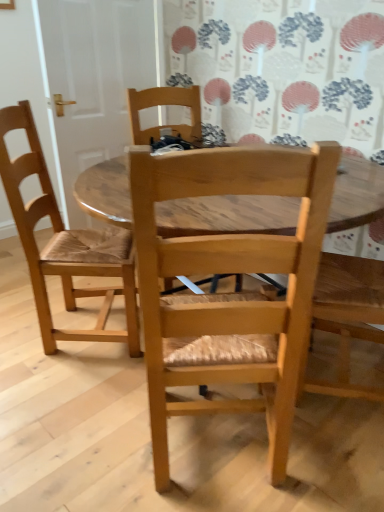
Question: Considering the positions of light wood/marble chair at center, the 2th chair viewed from the left, and light brown wood chair at left, which is counted as the 2th chair, starting from the right, in the image, is light wood/marble chair at center, the 2th chair viewed from the left, wider or thinner than light brown wood chair at left, which is counted as the 2th chair, starting from the right,?

Choices:
 (A) wide
 (B) thin

Answer: (A)

Question: In terms of height, does light wood/marble chair at center, the 2th chair viewed from the left, look taller or shorter compared to light brown wood chair at left, arranged as the first chair when viewed from the left?

Choices:
 (A) short
 (B) tall

Answer: (B)

Question: Choose the correct answer: Is light wood/marble chair at center, which ranks as the first chair in right-to-left order, inside light brown wood chair at left, which is counted as the 2th chair, starting from the right, or outside it?

Choices:
 (A) outside
 (B) inside

Answer: (A)

Question: Considering their positions, is light brown wood chair at left, arranged as the first chair when viewed from the left, located in front of or behind light wood/marble chair at center, which ranks as the first chair in right-to-left order?

Choices:
 (A) front
 (B) behind

Answer: (B)

Question: Looking at the image, does light brown wood chair at left, arranged as the first chair when viewed from the left, seem bigger or smaller compared to light wood/marble chair at center, which ranks as the first chair in right-to-left order?

Choices:
 (A) big
 (B) small

Answer: (B)

Question: From the image's perspective, is light brown wood chair at left, which is counted as the 2th chair, starting from the right, above or below light wood/marble chair at center, which ranks as the first chair in right-to-left order?

Choices:
 (A) above
 (B) below

Answer: (A)

Question: Considering the positions of light brown wood chair at left, which is counted as the 2th chair, starting from the right, and light wood/marble chair at center, the 2th chair viewed from the left, in the image, is light brown wood chair at left, which is counted as the 2th chair, starting from the right, taller or shorter than light wood/marble chair at center, the 2th chair viewed from the left,?

Choices:
 (A) short
 (B) tall

Answer: (A)